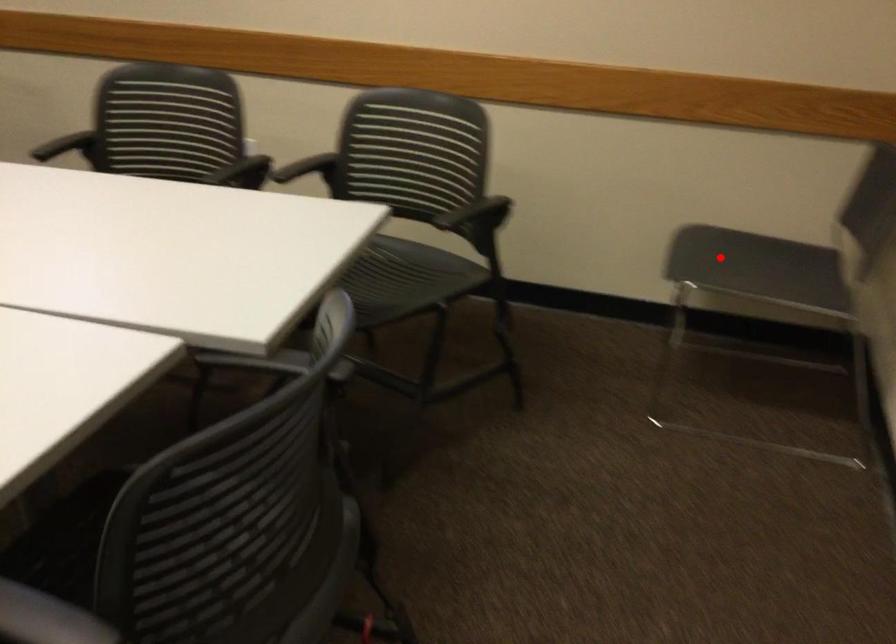
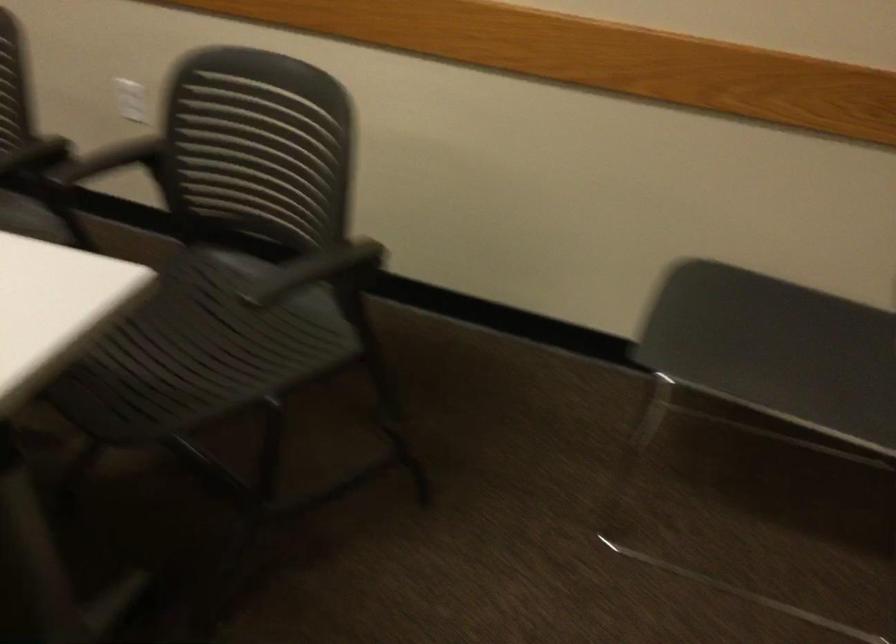
Question: I am providing you with two images of the same scene from different viewpoints. Given a red point in image1, look at the same physical point in image2. Is it:

Choices:
 (A) Closer to the viewpoint
 (B) Farther from the viewpoint

Answer: (A)